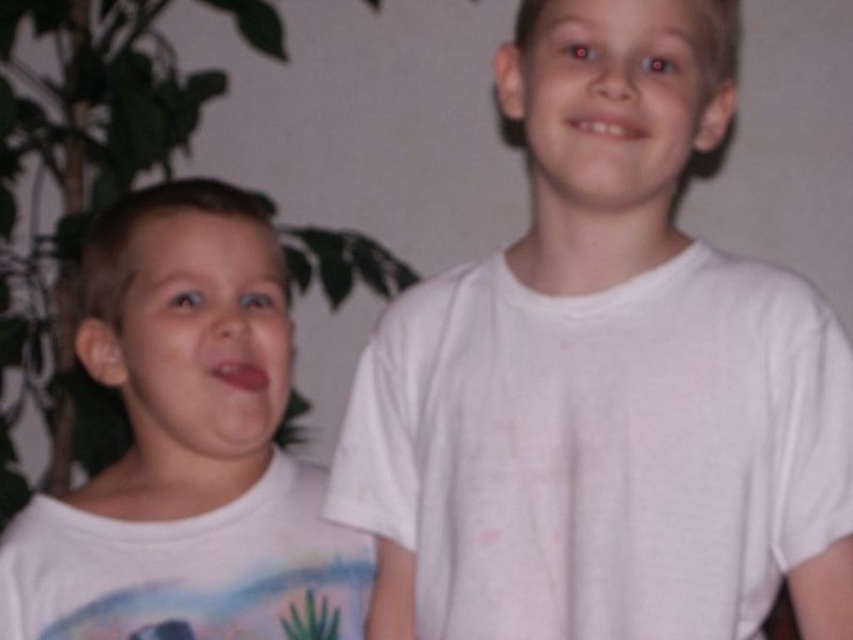
Who is positioned more to the left, white cotton shirt at center or white matte shirt at left?

white matte shirt at left is more to the left.

Which is in front, point (535, 205) or point (244, 259)?

Positioned in front is point (535, 205).

The width and height of the screenshot is (853, 640). What are the coordinates of `white cotton shirt at center` in the screenshot? It's located at (605, 378).